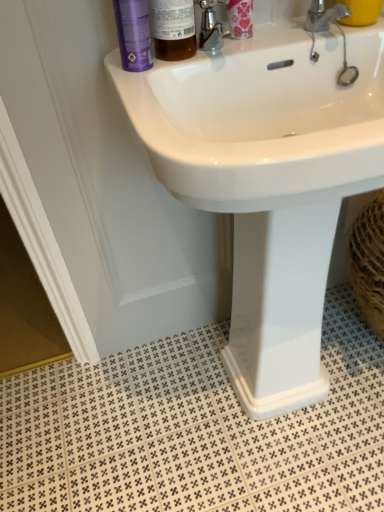
The image size is (384, 512). I want to click on white textured tile at lower center, so click(x=194, y=430).

At what (x,y) coordinates should I click in order to perform the action: click on floral-patterned plastic container at upper center. Please return your answer as a coordinate pair (x, y). This screenshot has height=512, width=384. Looking at the image, I should click on (240, 18).

In order to face white glossy sink at upper center, should I rotate leftwards or rightwards?

To face it directly, rotate right by 12.091 degrees.

The height and width of the screenshot is (512, 384). Find the location of `purple matte bottle at upper left`. purple matte bottle at upper left is located at coordinates (133, 34).

Is floral-patterned plastic container at upper center shorter than yellow matte cup at upper right?

Incorrect, the height of floral-patterned plastic container at upper center does not fall short of that of yellow matte cup at upper right.

How many degrees apart are the facing directions of floral-patterned plastic container at upper center and yellow matte cup at upper right?

The facing directions of floral-patterned plastic container at upper center and yellow matte cup at upper right are 0.0018 degrees apart.

From the image's perspective, is floral-patterned plastic container at upper center positioned above or below yellow matte cup at upper right?

floral-patterned plastic container at upper center is below yellow matte cup at upper right.

From a real-world perspective, which is physically above, floral-patterned plastic container at upper center or yellow matte cup at upper right?

From a 3D spatial view, floral-patterned plastic container at upper center is above.

Which object is further away from the camera taking this photo, white glossy sink at upper center or floral-patterned plastic container at upper center?

floral-patterned plastic container at upper center is more distant.

Is white glossy sink at upper center oriented towards floral-patterned plastic container at upper center?

No, white glossy sink at upper center is not oriented towards floral-patterned plastic container at upper center.

Is white glossy sink at upper center touching floral-patterned plastic container at upper center?

No.

Considering the positions of point (359, 84) and point (248, 0), is point (359, 84) closer or farther from the camera than point (248, 0)?

Point (359, 84) is farther from the camera than point (248, 0).

Considering the sizes of objects translucent amber bottle at upper center and purple matte bottle at upper left in the image provided, who is shorter, translucent amber bottle at upper center or purple matte bottle at upper left?

With less height is purple matte bottle at upper left.

Is translucent amber bottle at upper center placed right next to purple matte bottle at upper left?

Yes, translucent amber bottle at upper center is right next to purple matte bottle at upper left and making contact.

Between translucent amber bottle at upper center and purple matte bottle at upper left, which one has larger width?

With larger width is translucent amber bottle at upper center.

From a real-world perspective, who is located higher, translucent amber bottle at upper center or purple matte bottle at upper left?

translucent amber bottle at upper center, from a real-world perspective.

From a real-world perspective, is translucent amber bottle at upper center physically above silver metallic faucet at upper right?

Indeed, from a real-world perspective, translucent amber bottle at upper center stands above silver metallic faucet at upper right.

Does translucent amber bottle at upper center lie behind silver metallic faucet at upper right?

No, translucent amber bottle at upper center is closer to the viewer.

Is point (188, 1) positioned in front of point (309, 10)?

Yes.

Considering the sizes of silver metallic faucet at upper right and floral-patterned plastic container at upper center in the image, is silver metallic faucet at upper right taller or shorter than floral-patterned plastic container at upper center?

silver metallic faucet at upper right is shorter than floral-patterned plastic container at upper center.

How many degrees apart are the facing directions of silver metallic faucet at upper right and floral-patterned plastic container at upper center?

0.0016 degrees.

Does silver metallic faucet at upper right have a lesser width compared to floral-patterned plastic container at upper center?

In fact, silver metallic faucet at upper right might be wider than floral-patterned plastic container at upper center.

From the image's perspective, is silver metallic faucet at upper right positioned above or below floral-patterned plastic container at upper center?

Clearly, from the image's perspective, silver metallic faucet at upper right is below floral-patterned plastic container at upper center.

Is translucent amber bottle at upper center next to white textured tile at lower center and touching it?

No, translucent amber bottle at upper center is not touching white textured tile at lower center.

Does translucent amber bottle at upper center have a smaller size compared to white textured tile at lower center?

Correct, translucent amber bottle at upper center occupies less space than white textured tile at lower center.

Is translucent amber bottle at upper center spatially inside white textured tile at lower center, or outside of it?

translucent amber bottle at upper center is located beyond the bounds of white textured tile at lower center.

Considering the relative sizes of yellow matte cup at upper right and white textured tile at lower center in the image provided, is yellow matte cup at upper right taller than white textured tile at lower center?

Indeed, yellow matte cup at upper right has a greater height compared to white textured tile at lower center.

From the image's perspective, is yellow matte cup at upper right located above or below white textured tile at lower center?

yellow matte cup at upper right is above white textured tile at lower center.

Locate an element on the screen. This screenshot has height=512, width=384. liquid located above the white textured tile at lower center (from the image's perspective) is located at coordinates (361, 12).

Based on their positions, is yellow matte cup at upper right located to the left or right of white textured tile at lower center?

Based on their positions, yellow matte cup at upper right is located to the right of white textured tile at lower center.

Find the location of a particular element. liquid that appears above the floral-patterned plastic container at upper center (from the image's perspective) is located at coordinates (361, 12).

At what (x,y) coordinates should I click in order to perform the action: click on sink below the floral-patterned plastic container at upper center (from the image's perspective). Please return your answer as a coordinate pair (x, y). This screenshot has height=512, width=384. Looking at the image, I should click on (268, 181).

When comparing their distances from translucent amber bottle at upper center, does yellow matte cup at upper right or floral-patterned plastic container at upper center seem further?

The object further to translucent amber bottle at upper center is yellow matte cup at upper right.

When comparing their distances from yellow matte cup at upper right, does translucent amber bottle at upper center or purple matte bottle at upper left seem closer?

Based on the image, translucent amber bottle at upper center appears to be nearer to yellow matte cup at upper right.

Consider the image. Which object lies further to the anchor point silver metallic faucet at upper right, purple matte bottle at upper left or floral-patterned plastic container at upper center?

purple matte bottle at upper left lies further to silver metallic faucet at upper right than the other object.

Estimate the real-world distances between objects in this image. Which object is further from silver metallic faucet at upper right, floral-patterned plastic container at upper center or purple matte bottle at upper left?

purple matte bottle at upper left is positioned further to the anchor silver metallic faucet at upper right.

Based on their spatial positions, is floral-patterned plastic container at upper center or silver metallic faucet at upper right closer to purple matte bottle at upper left?

Among the two, floral-patterned plastic container at upper center is located nearer to purple matte bottle at upper left.

From the image, which object appears to be nearer to purple matte bottle at upper left, white textured tile at lower center or silver metallic faucet at upper right?

The object closer to purple matte bottle at upper left is silver metallic faucet at upper right.

Based on the photo, estimate the real-world distances between objects in this image. Which object is closer to yellow matte cup at upper right, white glossy sink at upper center or white textured tile at lower center?

Among the two, white glossy sink at upper center is located nearer to yellow matte cup at upper right.

Looking at the image, which one is located further to silver metallic faucet at upper right, floral-patterned plastic container at upper center or white textured tile at lower center?

white textured tile at lower center is further to silver metallic faucet at upper right.

Where is `tap between purple matte bottle at upper left and yellow matte cup at upper right from left to right`? tap between purple matte bottle at upper left and yellow matte cup at upper right from left to right is located at coordinates (324, 16).

Where is `bottle located between purple matte bottle at upper left and floral-patterned plastic container at upper center in the left-right direction`? This screenshot has height=512, width=384. bottle located between purple matte bottle at upper left and floral-patterned plastic container at upper center in the left-right direction is located at coordinates (173, 29).

I want to click on bottle between yellow matte cup at upper right and white textured tile at lower center in the up-down direction, so click(x=173, y=29).

Find the location of a particular element. toiletry that lies between yellow matte cup at upper right and white textured tile at lower center from top to bottom is located at coordinates (240, 18).